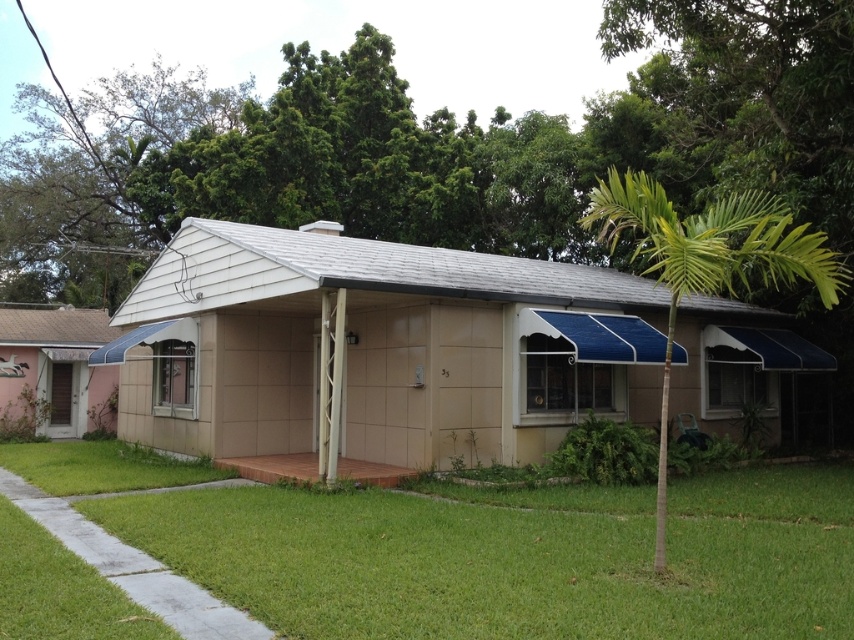
You are a gardener who needs to water the green grass at lower center using a hose reel stored in the beige tile shed at center. Can you reach the grass with a standard 3 meter hose without moving the reel?

The distance between the beige tile shed at center and the green grass at lower center is 3.14 meters. Since a standard hose is only 3 meters long, it would be 14 centimeters too short to reach the grass without moving the reel.

You are standing at the entrance of the house and want to locate the beige tile shed at center. According to the coordinates provided, where should you look relative to your current position?

The beige tile shed at center is located at coordinates point (375, 349), which means it is positioned slightly to the right and forward from your current position at the entrance.

You are planning to install a new garden feature between the beige tile shed at center and the green grass at lower center. Considering their sizes, which object should you place the feature closer to to ensure it doesn

The beige tile shed at center is larger in size than the green grass at lower center, so you should place the garden feature closer to the green grass at lower center to maintain balance.